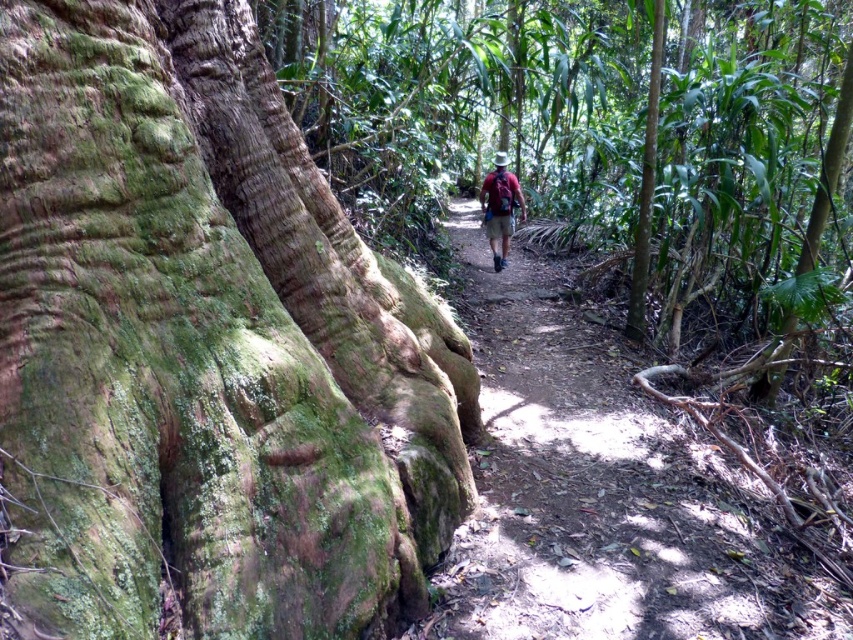
You are standing at the entrance of the forest and see the brown dirt trail at center. If you want to follow the trail to reach a point exactly at coordinate 0.766, 0.708, which direction should you walk relative to the trail?

The brown dirt trail at center is located at point (602,490), so you should walk straight along the trail to reach that coordinate.

You are standing on the dirt path in the tropical forest scene. You notice two points marked in the image. The first point is at coordinate point (x=498, y=634) and the second is at point (x=511, y=205). Which point is nearer to you as you stand on the path?

Point (x=498, y=634) is closer to the viewer than point (x=511, y=205), so the first point is nearer to you.